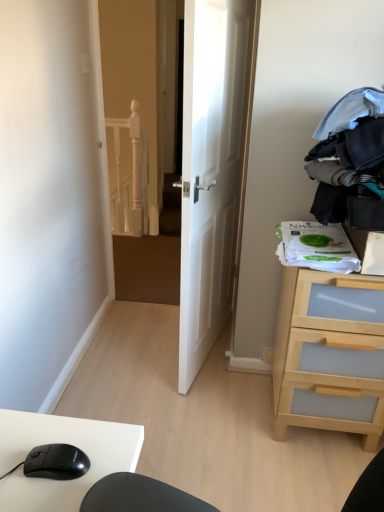
Where is `light wood/transparent drawer at right`? Image resolution: width=384 pixels, height=512 pixels. light wood/transparent drawer at right is located at coordinates (330, 354).

This screenshot has height=512, width=384. I want to click on light wood/transparent drawer at right, so click(330, 354).

Does point (280, 389) come behind point (247, 125)?

No, it is in front of (247, 125).

Would you say light wood/transparent drawer at right is a long distance from white glossy door at center?

No, there isn't a large distance between light wood/transparent drawer at right and white glossy door at center.

Considering the sizes of objects light wood/transparent drawer at right and white glossy door at center in the image provided, who is bigger, light wood/transparent drawer at right or white glossy door at center?

white glossy door at center.

You are a GUI agent. You are given a task and a screenshot of the screen. Output one action in this format:
    pyautogui.click(x=<x>, y=<y>)
    Task: Click on the chest of drawers behind the white glossy door at center
    The image size is (384, 512).
    Given the screenshot: What is the action you would take?
    pyautogui.click(x=330, y=354)

Is black matte mouse at lower left oriented away from white glossy door at center?

No, black matte mouse at lower left is not facing away from white glossy door at center.

Is black matte mouse at lower left with white glossy door at center?

black matte mouse at lower left and white glossy door at center are clearly separated.

From a real-world perspective, relative to white glossy door at center, is black matte mouse at lower left vertically above or below?

From a real-world perspective, black matte mouse at lower left is physically below white glossy door at center.

Is white glossy door at center directly adjacent to black matte mouse at lower left?

There is a gap between white glossy door at center and black matte mouse at lower left.

Between white glossy door at center and black matte mouse at lower left, which one appears on the right side from the viewer's perspective?

From the viewer's perspective, white glossy door at center appears more on the right side.

Could you tell me if white glossy door at center is facing black matte mouse at lower left?

No, white glossy door at center does not turn towards black matte mouse at lower left.

Who is bigger, dark blue fabric at upper right or light wood/transparent drawer at right?

light wood/transparent drawer at right is bigger.

From the image's perspective, does dark blue fabric at upper right appear lower than light wood/transparent drawer at right?

Actually, dark blue fabric at upper right appears above light wood/transparent drawer at right in the image.

Is dark blue fabric at upper right positioned far away from light wood/transparent drawer at right?

No.

Considering the sizes of objects light wood/transparent drawer at right and dark blue fabric at upper right in the image provided, who is wider, light wood/transparent drawer at right or dark blue fabric at upper right?

dark blue fabric at upper right.

Does light wood/transparent drawer at right have a larger size compared to dark blue fabric at upper right?

Yes, light wood/transparent drawer at right is bigger than dark blue fabric at upper right.

Considering the relative positions of light wood/transparent drawer at right and dark blue fabric at upper right in the image provided, is light wood/transparent drawer at right to the right of dark blue fabric at upper right from the viewer's perspective?

Yes, light wood/transparent drawer at right is to the right of dark blue fabric at upper right.

Is point (349, 298) positioned behind point (334, 174)?

Yes, it is behind point (334, 174).

Is point (69, 466) more distant than point (359, 89)?

No, it is in front of (359, 89).

Is black matte mouse at lower left positioned beyond the bounds of dark blue fabric at upper right?

Yes, black matte mouse at lower left is not within dark blue fabric at upper right.

Which is behind, black matte mouse at lower left or dark blue fabric at upper right?

dark blue fabric at upper right is further from the camera.

Which object is wider, white glossy door at center or light wood/transparent drawer at right?

Wider between the two is light wood/transparent drawer at right.

Considering the sizes of white glossy door at center and light wood/transparent drawer at right in the image, is white glossy door at center bigger or smaller than light wood/transparent drawer at right?

In the image, white glossy door at center appears to be larger than light wood/transparent drawer at right.

Find the location of a particular element. door above the light wood/transparent drawer at right (from a real-world perspective) is located at coordinates (212, 167).

Considering the positions of objects white glossy door at center and light wood/transparent drawer at right in the image provided, who is behind, white glossy door at center or light wood/transparent drawer at right?

light wood/transparent drawer at right is more distant.

What are the coordinates of `the chest of drawers behind the white glossy door at center` in the screenshot? It's located at (330, 354).

You are a GUI agent. You are given a task and a screenshot of the screen. Output one action in this format:
    pyautogui.click(x=<x>, y=<y>)
    Task: Click on the mouse in front of the white glossy door at center
    
    Given the screenshot: What is the action you would take?
    pyautogui.click(x=56, y=462)

Considering their positions, is light wood/transparent drawer at right positioned closer to white glossy door at center than black matte mouse at lower left?

light wood/transparent drawer at right is positioned closer to the anchor white glossy door at center.

From the image, which object appears to be farther from dark blue fabric at upper right, light wood/transparent drawer at right or black matte mouse at lower left?

black matte mouse at lower left.

From the image, which object appears to be farther from black matte mouse at lower left, dark blue fabric at upper right or light wood/transparent drawer at right?

The object further to black matte mouse at lower left is light wood/transparent drawer at right.

Estimate the real-world distances between objects in this image. Which object is further from light wood/transparent drawer at right, black matte mouse at lower left or white glossy door at center?

black matte mouse at lower left lies further to light wood/transparent drawer at right than the other object.

Estimate the real-world distances between objects in this image. Which object is further from black matte mouse at lower left, light wood/transparent drawer at right or white glossy door at center?

The object further to black matte mouse at lower left is white glossy door at center.

Estimate the real-world distances between objects in this image. Which object is further from light wood/transparent drawer at right, white glossy door at center or dark blue fabric at upper right?

Among the two, white glossy door at center is located further to light wood/transparent drawer at right.

From the image, which object appears to be nearer to dark blue fabric at upper right, black matte mouse at lower left or white glossy door at center?

white glossy door at center lies closer to dark blue fabric at upper right than the other object.

From the image, which object appears to be nearer to white glossy door at center, dark blue fabric at upper right or light wood/transparent drawer at right?

Based on the image, dark blue fabric at upper right appears to be nearer to white glossy door at center.

Image resolution: width=384 pixels, height=512 pixels. Identify the location of door between dark blue fabric at upper right and light wood/transparent drawer at right in the up-down direction. (212, 167).

Identify the location of door between black matte mouse at lower left and dark blue fabric at upper right from left to right. (212, 167).

Find the location of a particular element. clothing between black matte mouse at lower left and light wood/transparent drawer at right from left to right is located at coordinates (350, 162).

You are a GUI agent. You are given a task and a screenshot of the screen. Output one action in this format:
    pyautogui.click(x=<x>, y=<y>)
    Task: Click on the door between black matte mouse at lower left and light wood/transparent drawer at right from left to right
    The image size is (384, 512).
    Given the screenshot: What is the action you would take?
    pyautogui.click(x=212, y=167)